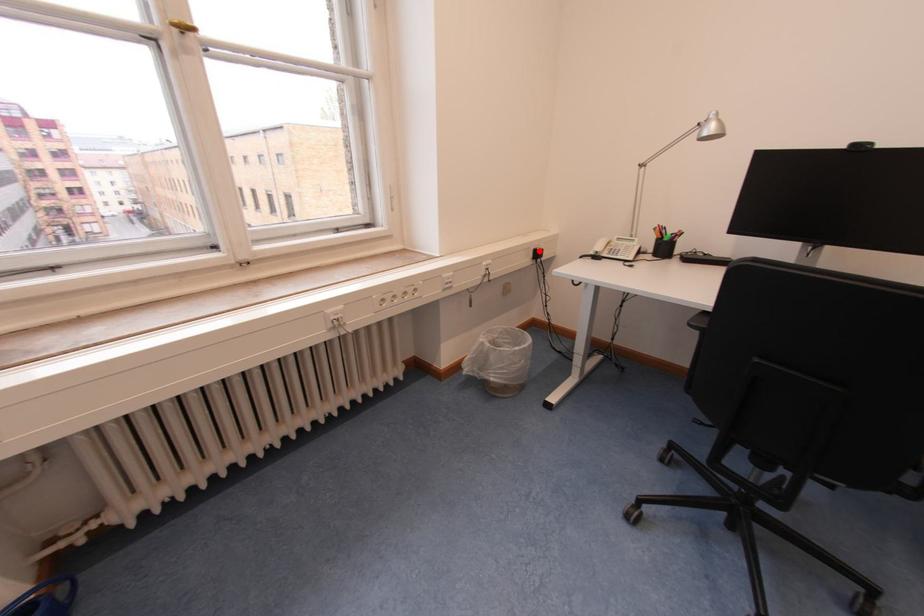
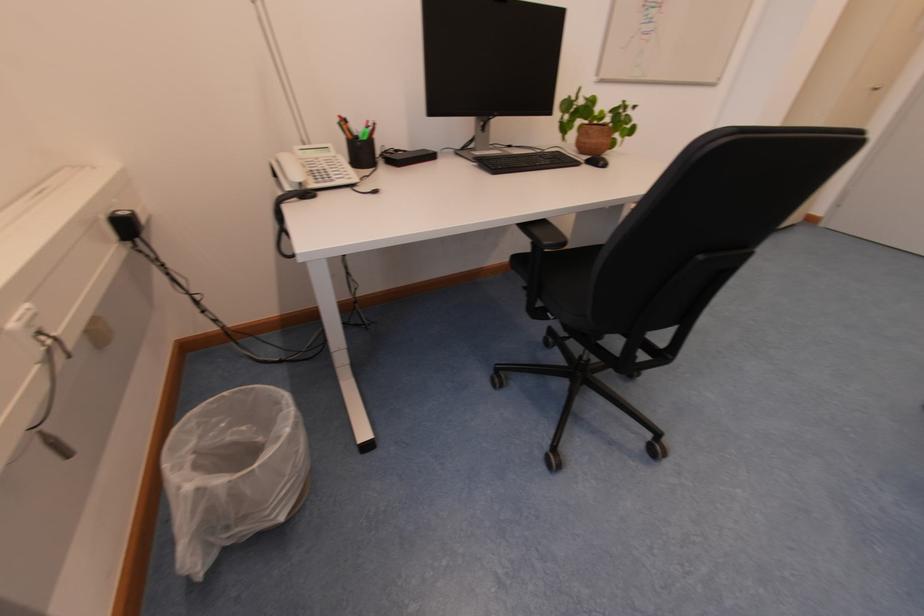
Locate, in the second image, the point that corresponds to the highlighted location in the first image.

(111, 220)